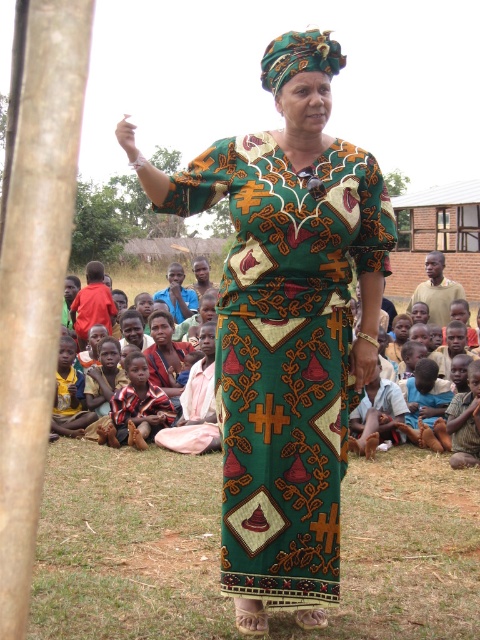
Between green woven dress at center and brown rough tree trunk at left, which one appears on the right side from the viewer's perspective?

From the viewer's perspective, green woven dress at center appears more on the right side.

At what (x,y) coordinates should I click in order to perform the action: click on green woven dress at center. Please return your answer as a coordinate pair (x, y). The image size is (480, 640). Looking at the image, I should click on (286, 353).